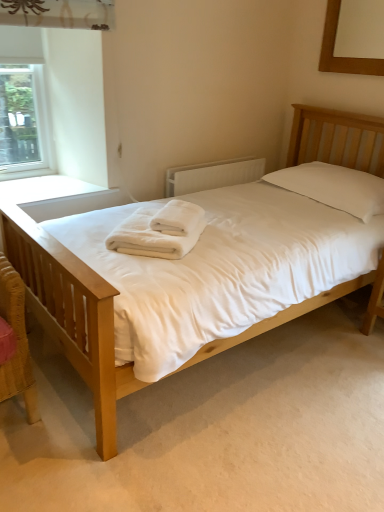
The image size is (384, 512). What do you see at coordinates (177, 218) in the screenshot? I see `white soft towel at center, placed as the 1th bath towel when sorted from top to bottom` at bounding box center [177, 218].

What do you see at coordinates (213, 175) in the screenshot? The height and width of the screenshot is (512, 384). I see `white textured radiator at center` at bounding box center [213, 175].

Find the location of a particular element. light wood bed at center is located at coordinates (72, 304).

Image resolution: width=384 pixels, height=512 pixels. I want to click on clear glass window at upper left, so click(24, 122).

Identify the location of white soft towel at center, which appears as the second bath towel when viewed from the top. (159, 231).

Find the location of a particular element. The width and height of the screenshot is (384, 512). white soft towel at center, placed as the second bath towel when sorted from bottom to top is located at coordinates (177, 218).

How many degrees apart are the facing directions of white textured radiator at center and light wood bed at center?

The angular difference between white textured radiator at center and light wood bed at center is 1.35 degrees.

Consider the image. Which object is positioned more to the right, white textured radiator at center or light wood bed at center?

light wood bed at center.

Is point (207, 180) positioned in front of point (112, 291)?

No, it is behind (112, 291).

From a real-world perspective, who is located higher, white textured radiator at center or light wood bed at center?

From a 3D spatial view, white textured radiator at center is above.

From the picture: Is wooden picture frame at upper right turned away from white soft towel at center, placed as the 1th bath towel when sorted from top to bottom?

No.

From a real-world perspective, is wooden picture frame at upper right positioned under white soft towel at center, placed as the 1th bath towel when sorted from top to bottom, based on gravity?

No, from a real-world perspective, wooden picture frame at upper right is not under white soft towel at center, placed as the 1th bath towel when sorted from top to bottom.

Is wooden picture frame at upper right far away from white soft towel at center, placed as the second bath towel when sorted from bottom to top?

Yes, wooden picture frame at upper right is far from white soft towel at center, placed as the second bath towel when sorted from bottom to top.

From the image's perspective, is wooden picture frame at upper right under white soft towel at center, placed as the 1th bath towel when sorted from top to bottom?

No.

Identify the location of window above the light wood bed at center (from a real-world perspective). This screenshot has width=384, height=512. (24, 122).

Is the surface of clear glass window at upper left in direct contact with light wood bed at center?

No, clear glass window at upper left is not next to light wood bed at center.

Would you say clear glass window at upper left is outside light wood bed at center?

That's correct, clear glass window at upper left is outside of light wood bed at center.

Which is more to the right, white soft towel at center, which ranks as the first bath towel in bottom-to-top order, or white textured radiator at center?

Positioned to the right is white textured radiator at center.

Can you tell me how much white soft towel at center, which ranks as the first bath towel in bottom-to-top order, and white textured radiator at center differ in facing direction?

The angle between the facing direction of white soft towel at center, which ranks as the first bath towel in bottom-to-top order, and the facing direction of white textured radiator at center is 53.8 degrees.

From a real-world perspective, is white soft towel at center, which appears as the second bath towel when viewed from the top, positioned above or below white textured radiator at center?

white soft towel at center, which appears as the second bath towel when viewed from the top, is above white textured radiator at center.

Does white soft towel at center, which appears as the second bath towel when viewed from the top, have a smaller size compared to white textured radiator at center?

Yes, white soft towel at center, which appears as the second bath towel when viewed from the top, is smaller than white textured radiator at center.

From a real-world perspective, between white soft towel at center, placed as the 1th bath towel when sorted from top to bottom, and clear glass window at upper left, who is vertically higher?

From a 3D spatial view, clear glass window at upper left is above.

From their relative heights in the image, would you say white soft towel at center, placed as the second bath towel when sorted from bottom to top, is taller or shorter than clear glass window at upper left?

Considering their sizes, white soft towel at center, placed as the second bath towel when sorted from bottom to top, has less height than clear glass window at upper left.

Does white soft towel at center, placed as the second bath towel when sorted from bottom to top, appear on the right side of clear glass window at upper left?

Yes.

Does white soft towel at center, placed as the second bath towel when sorted from bottom to top, have a lesser width compared to clear glass window at upper left?

No.

Considering the relative sizes of wooden picture frame at upper right and clear glass window at upper left in the image provided, is wooden picture frame at upper right bigger than clear glass window at upper left?

Actually, wooden picture frame at upper right might be smaller than clear glass window at upper left.

Is wooden picture frame at upper right far from clear glass window at upper left?

Indeed, wooden picture frame at upper right is not near clear glass window at upper left.

Which is in front, point (376, 74) or point (4, 78)?

The point (4, 78) is in front.

Would you say white textured radiator at center is outside white soft towel at center, which ranks as the first bath towel in bottom-to-top order?

white textured radiator at center lies outside white soft towel at center, which ranks as the first bath towel in bottom-to-top order,'s area.

Considering the sizes of objects white textured radiator at center and white soft towel at center, which ranks as the first bath towel in bottom-to-top order, in the image provided, who is bigger, white textured radiator at center or white soft towel at center, which ranks as the first bath towel in bottom-to-top order,?

white textured radiator at center is bigger.

Relative to white soft towel at center, which appears as the second bath towel when viewed from the top, is white textured radiator at center in front or behind?

In the image, white textured radiator at center appears behind white soft towel at center, which appears as the second bath towel when viewed from the top.

Identify the location of radiator below the white soft towel at center, which appears as the second bath towel when viewed from the top (from a real-world perspective). (213, 175).

Where is `radiator behind the light wood bed at center`? This screenshot has height=512, width=384. radiator behind the light wood bed at center is located at coordinates (213, 175).

At what (x,y) coordinates should I click in order to perform the action: click on the 1st bath towel in front of the wooden picture frame at upper right. Please return your answer as a coordinate pair (x, y). The width and height of the screenshot is (384, 512). Looking at the image, I should click on (177, 218).

Based on their spatial positions, is white soft towel at center, placed as the 1th bath towel when sorted from top to bottom, or wooden picture frame at upper right further from white textured radiator at center?

wooden picture frame at upper right.

Which object lies further to the anchor point white textured radiator at center, clear glass window at upper left or wooden picture frame at upper right?

Based on the image, clear glass window at upper left appears to be further to white textured radiator at center.

Considering their positions, is white soft towel at center, placed as the 1th bath towel when sorted from top to bottom, positioned closer to white textured radiator at center than clear glass window at upper left?

white soft towel at center, placed as the 1th bath towel when sorted from top to bottom.

Which object lies further to the anchor point wooden picture frame at upper right, white soft towel at center, placed as the 1th bath towel when sorted from top to bottom, or white textured radiator at center?

Based on the image, white soft towel at center, placed as the 1th bath towel when sorted from top to bottom, appears to be further to wooden picture frame at upper right.

Considering their positions, is wooden picture frame at upper right positioned closer to white soft towel at center, which ranks as the first bath towel in bottom-to-top order, than clear glass window at upper left?

clear glass window at upper left lies closer to white soft towel at center, which ranks as the first bath towel in bottom-to-top order, than the other object.

In the scene shown: Which object lies nearer to the anchor point light wood bed at center, white textured radiator at center or white soft towel at center, placed as the second bath towel when sorted from bottom to top?

white soft towel at center, placed as the second bath towel when sorted from bottom to top, lies closer to light wood bed at center than the other object.

Looking at the image, which one is located closer to white soft towel at center, placed as the 1th bath towel when sorted from top to bottom, clear glass window at upper left or white textured radiator at center?

Based on the image, white textured radiator at center appears to be nearer to white soft towel at center, placed as the 1th bath towel when sorted from top to bottom.

Based on their spatial positions, is wooden picture frame at upper right or white soft towel at center, which ranks as the first bath towel in bottom-to-top order, further from clear glass window at upper left?

Among the two, wooden picture frame at upper right is located further to clear glass window at upper left.

I want to click on bath towel between wooden picture frame at upper right and light wood bed at center vertically, so click(x=177, y=218).

In order to click on bath towel between clear glass window at upper left and white soft towel at center, placed as the second bath towel when sorted from bottom to top in this screenshot , I will do `click(159, 231)`.

Find the location of a particular element. This screenshot has width=384, height=512. bed between wooden picture frame at upper right and white soft towel at center, which ranks as the first bath towel in bottom-to-top order, vertically is located at coordinates (72, 304).

At what (x,y) coordinates should I click in order to perform the action: click on bath towel between wooden picture frame at upper right and white soft towel at center, which ranks as the first bath towel in bottom-to-top order, in the up-down direction. Please return your answer as a coordinate pair (x, y). Looking at the image, I should click on [x=177, y=218].